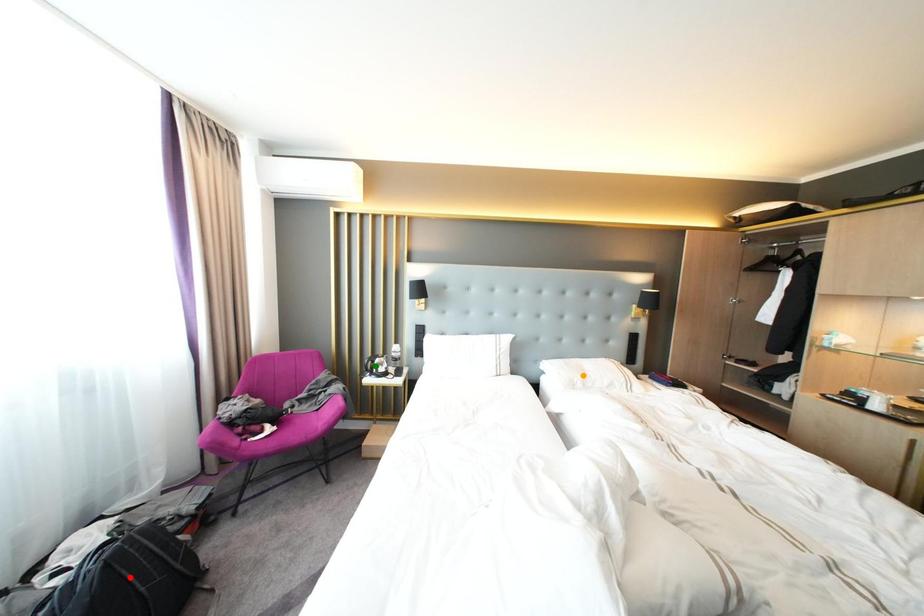
Consider the image. Order these from nearest to farthest:
orange point | green point | red point

red point
green point
orange point